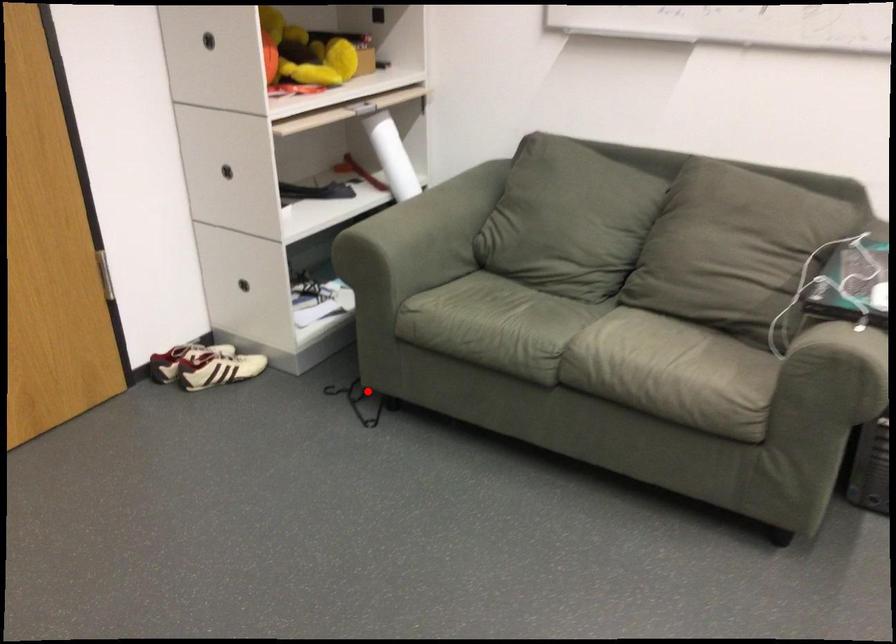
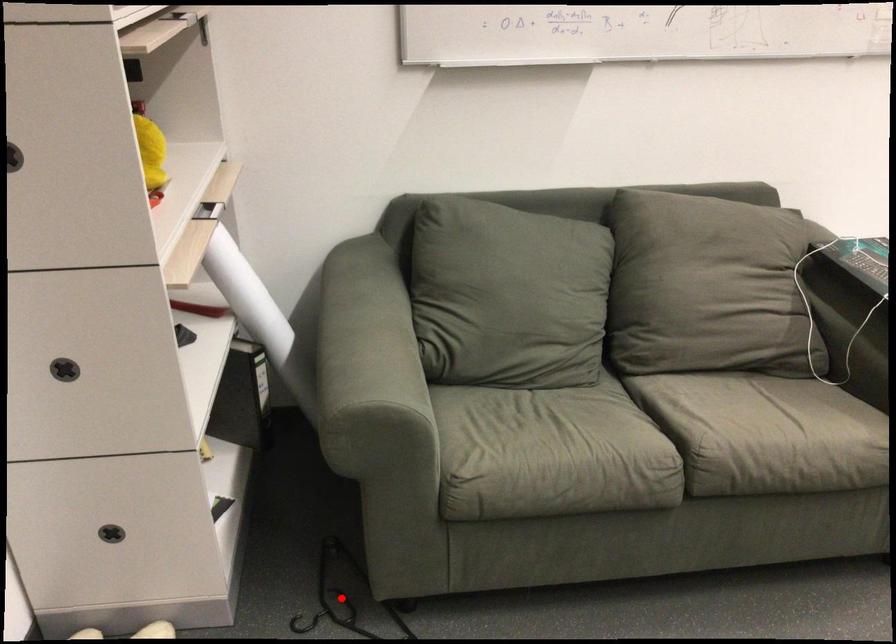
I am providing you with two images of the same scene from different viewpoints. A red point is marked on the first image and another point is marked on the second image. Do the highlighted points in image1 and image2 indicate the same real-world spot?

Yes